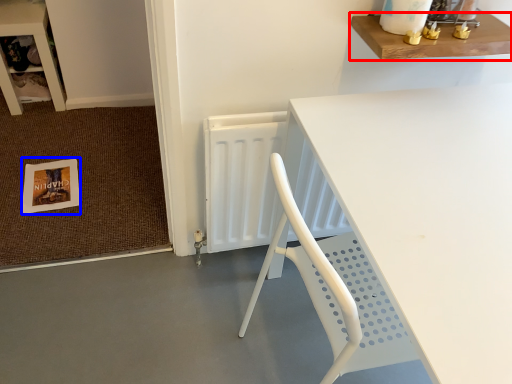
Question: Which object is further to the camera taking this photo, shelf (highlighted by a red box) or postcard (highlighted by a blue box)?

Choices:
 (A) shelf
 (B) postcard

Answer: (B)